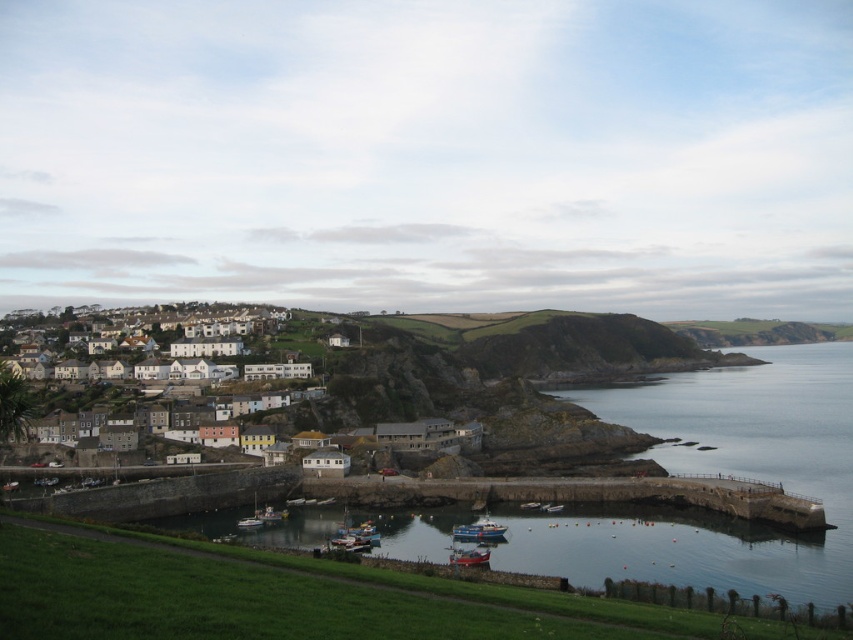
You are standing on the grassy slope looking towards the harbor. You see two boats, the red plastic boat at lower center and the white plastic boat at lower center. Which boat is closer to you?

The red plastic boat at lower center is closer to the viewer than the white plastic boat at lower center.

You are standing at the top of the grassy slope overlooking the harbor and the town. You want to take a photo that includes both the white stone houses at left and the metallic blue boat at lower center. Which object should you frame first in your camera viewfinder to ensure both are in the shot?

You should frame the white stone houses at left first because they are closer to the viewer than the metallic blue boat at lower center. By starting with the closer object, you can adjust the camera angle to include the farther object without missing it.

You are standing on the grassy slope looking towards the harbor. You see the blue metallic boat at center and the metallic blue boat at lower center. Which boat is positioned to the right of the other?

The blue metallic boat at center is positioned to the right of the metallic blue boat at lower center.